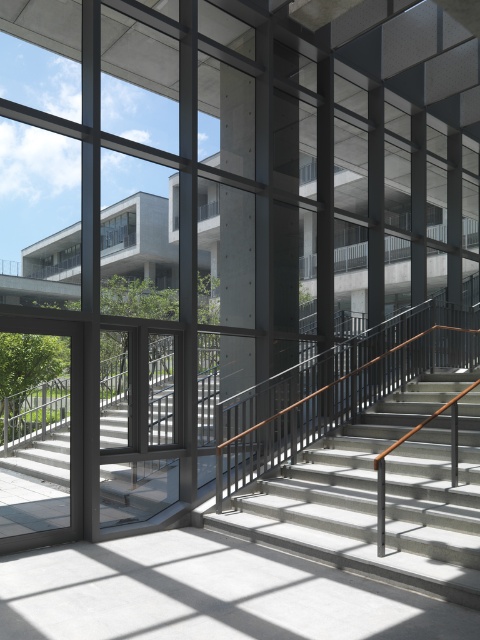
You are standing at the entrance of the building and want to locate the concrete at center. According to the coordinates provided, where should you look to find it?

The concrete at center is located at point coordinates of (237,257).

You are an architect designing a new building and want to ensure that the concrete at center and the clear glass window at upper left are proportionate. Based on the image, which object should you consider enlarging to maintain a balanced design?

The concrete at center has a smaller size compared to the clear glass window at upper left, so you should consider enlarging the concrete at center to achieve a more balanced design.

You are standing at the base of the staircase and want to locate the polished metal railing at center and the clear glass window at upper left. According to the scene, which object is positioned to the right side of the other?

The polished metal railing at center is to the right of the clear glass window at upper left.